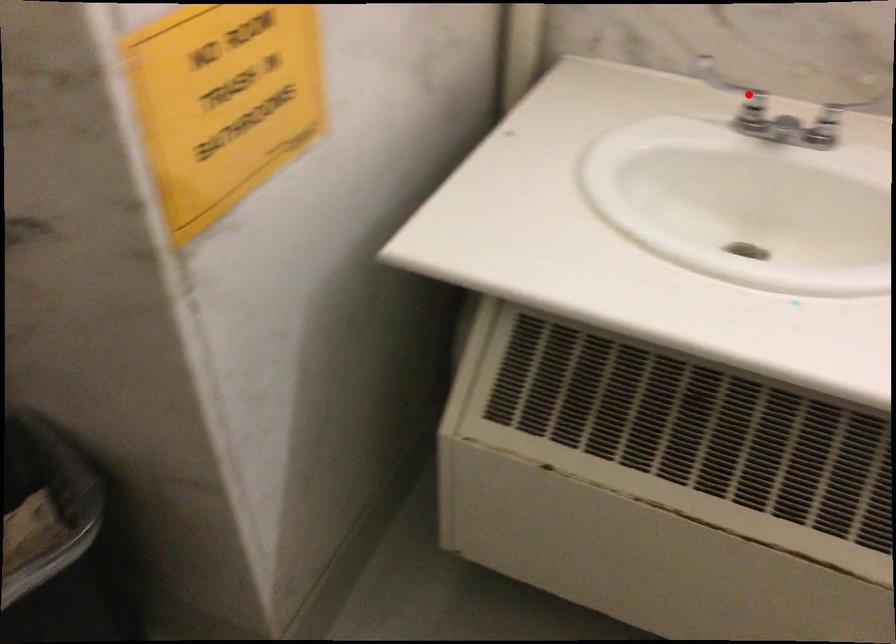
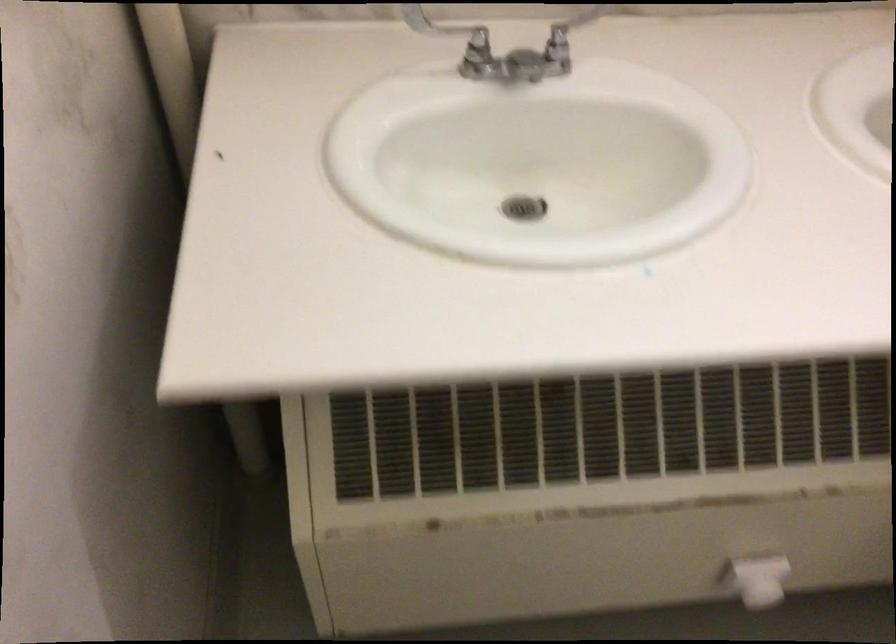
Question: I am providing you with two images of the same scene from different viewpoints. A red point is marked on the first image. At the location where the point appears in image 1, is it still visible in image 2?

Choices:
 (A) Yes
 (B) No

Answer: (A)